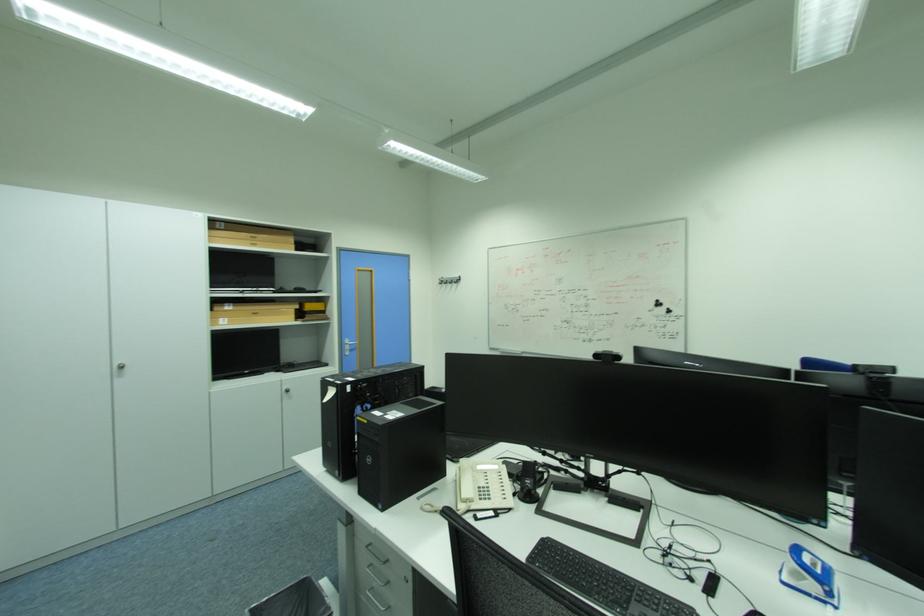
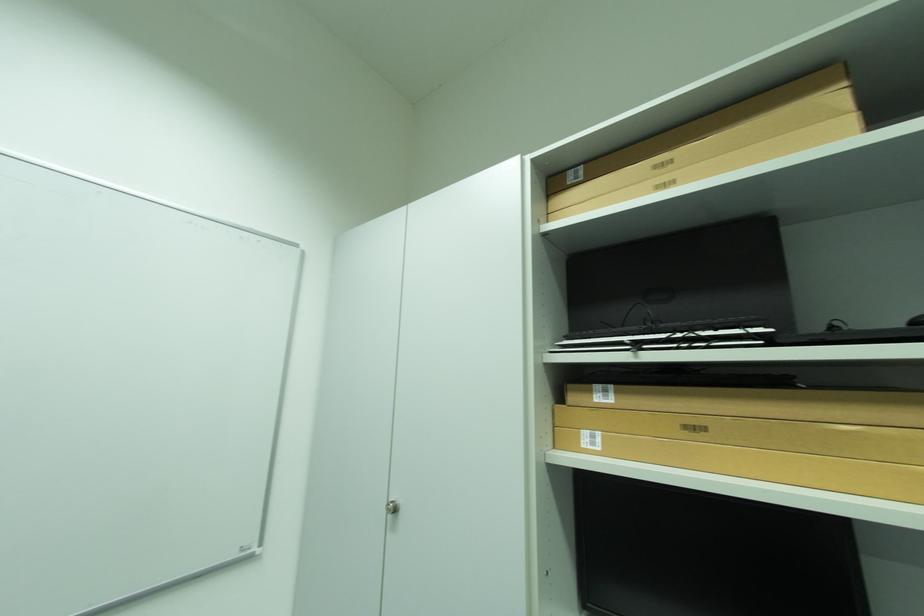
Locate, in the second image, the point that corresponds to point 228,320 in the first image.

(593, 434)